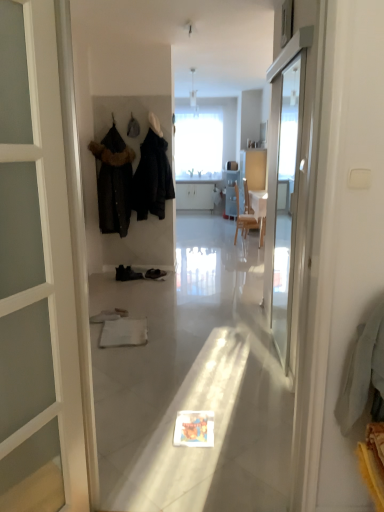
Question: Is dark matte coat at center, which ranks as the first clothing in right-to-left order, oriented away from black fur-trimmed coat at left, which ranks as the first clothing in left-to-right order?

Choices:
 (A) no
 (B) yes

Answer: (A)

Question: Does dark matte coat at center, which ranks as the first clothing in right-to-left order, appear on the left side of black fur-trimmed coat at left, the 2th clothing positioned from the right?

Choices:
 (A) no
 (B) yes

Answer: (A)

Question: Can you confirm if dark matte coat at center, placed as the 2th clothing when sorted from left to right, is smaller than black fur-trimmed coat at left, which ranks as the first clothing in left-to-right order?

Choices:
 (A) no
 (B) yes

Answer: (A)

Question: Does dark matte coat at center, which ranks as the first clothing in right-to-left order, have a greater height compared to black fur-trimmed coat at left, the 2th clothing positioned from the right?

Choices:
 (A) yes
 (B) no

Answer: (B)

Question: Would you say dark matte coat at center, placed as the 2th clothing when sorted from left to right, contains black fur-trimmed coat at left, the 2th clothing positioned from the right?

Choices:
 (A) yes
 (B) no

Answer: (B)

Question: Considering the relative positions of dark matte coat at center, which ranks as the first clothing in right-to-left order, and black fur-trimmed coat at left, which ranks as the first clothing in left-to-right order, in the image provided, is dark matte coat at center, which ranks as the first clothing in right-to-left order, in front of black fur-trimmed coat at left, which ranks as the first clothing in left-to-right order,?

Choices:
 (A) no
 (B) yes

Answer: (B)

Question: Is transparent glass screen door at right not inside dark matte coat at center, placed as the 2th clothing when sorted from left to right?

Choices:
 (A) yes
 (B) no

Answer: (A)

Question: Does transparent glass screen door at right come behind dark matte coat at center, which ranks as the first clothing in right-to-left order?

Choices:
 (A) yes
 (B) no

Answer: (B)

Question: Is the depth of transparent glass screen door at right less than that of dark matte coat at center, placed as the 2th clothing when sorted from left to right?

Choices:
 (A) no
 (B) yes

Answer: (B)

Question: Is transparent glass screen door at right taller than dark matte coat at center, which ranks as the first clothing in right-to-left order?

Choices:
 (A) yes
 (B) no

Answer: (A)

Question: Could dark matte coat at center, placed as the 2th clothing when sorted from left to right, be considered to be inside transparent glass screen door at right?

Choices:
 (A) yes
 (B) no

Answer: (B)

Question: From the image's perspective, is transparent glass screen door at right over dark matte coat at center, which ranks as the first clothing in right-to-left order?

Choices:
 (A) yes
 (B) no

Answer: (B)

Question: Is transparent glass screen door at right at the right side of black fur-trimmed coat at left, which ranks as the first clothing in left-to-right order?

Choices:
 (A) yes
 (B) no

Answer: (A)